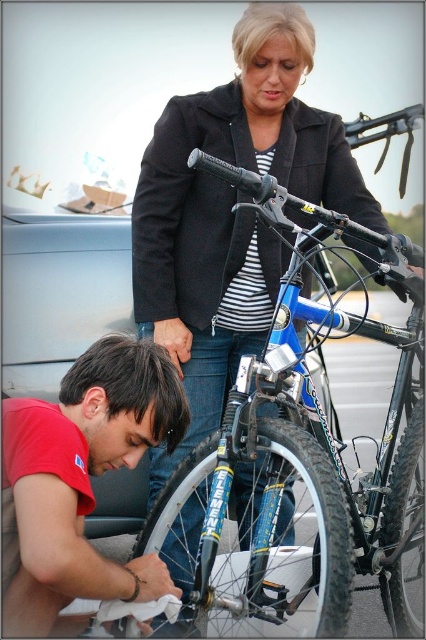
Question: Considering the relative positions of blue matte bicycle at center and black rubber tire at lower right in the image provided, where is blue matte bicycle at center located with respect to black rubber tire at lower right?

Choices:
 (A) left
 (B) right

Answer: (A)

Question: Based on their relative distances, which object is farther from the blue rubber tire at lower center?

Choices:
 (A) black rubber tire at lower right
 (B) matte red shirt at lower left

Answer: (B)

Question: Does blue matte bicycle at center appear on the right side of matte red shirt at lower left?

Choices:
 (A) yes
 (B) no

Answer: (A)

Question: Which is nearer to the blue matte bicycle at center?

Choices:
 (A) matte red shirt at lower left
 (B) black rubber tire at lower right

Answer: (B)

Question: Can you confirm if blue matte bicycle at center is smaller than blue rubber tire at lower center?

Choices:
 (A) no
 (B) yes

Answer: (A)

Question: Which point is farther to the camera?

Choices:
 (A) matte red shirt at lower left
 (B) black rubber tire at lower right
 (C) blue rubber tire at lower center

Answer: (B)